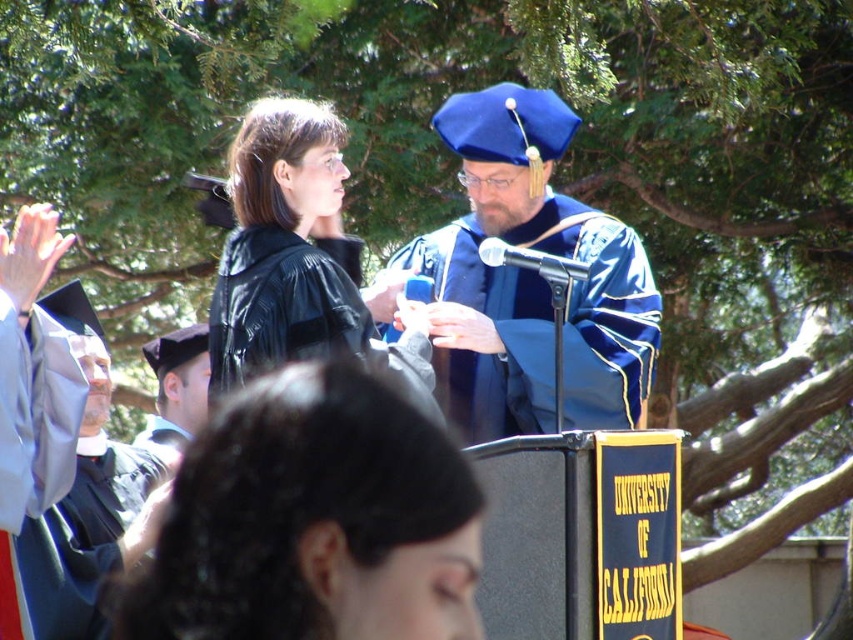
You are standing at the ceremony and want to take a photo of the matte black gown at upper left. If your camera has a maximum focus range of 6 meters, will you be able to capture a clear photo?

The matte black gown at upper left is 6.35 meters away from the viewer. Since the camera can only focus up to 6 meters, it won t be able to capture a clear photo.